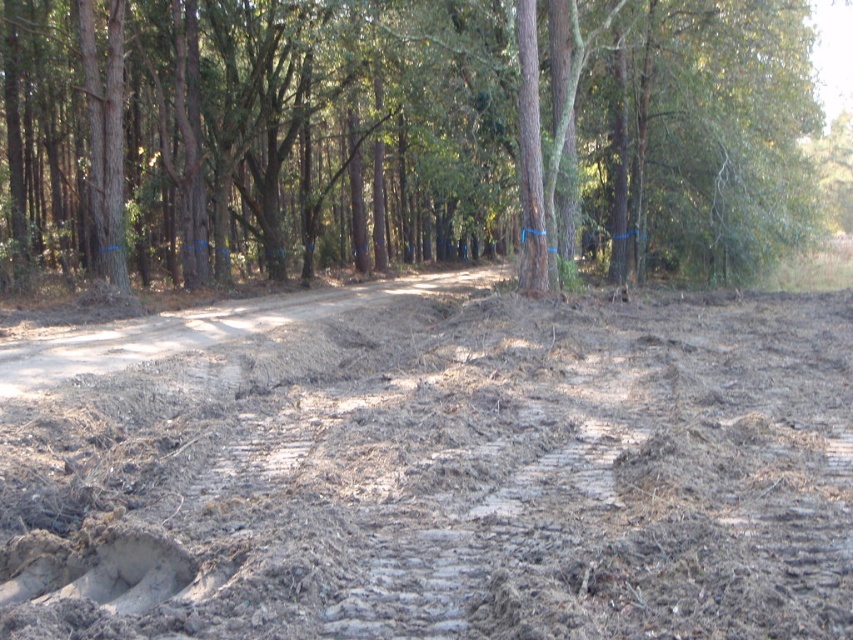
You are a hiker carrying a heavy backpack and need to cross the area shown. You see the dull brown mud at center and the dirt road at center. Which surface should you choose to avoid sinking into the ground?

The dirt road at center is taller than the dull brown mud at center, so choosing the dirt road at center would provide a firmer surface and prevent sinking.

From the picture: You are standing on the dirt path in the forest and see two points marked in the image. The first point is at coordinates point (131, 512) and the second is at point (810, 54). Which point is closer to you?

Point (131, 512) is closer to the viewer than point (810, 54).